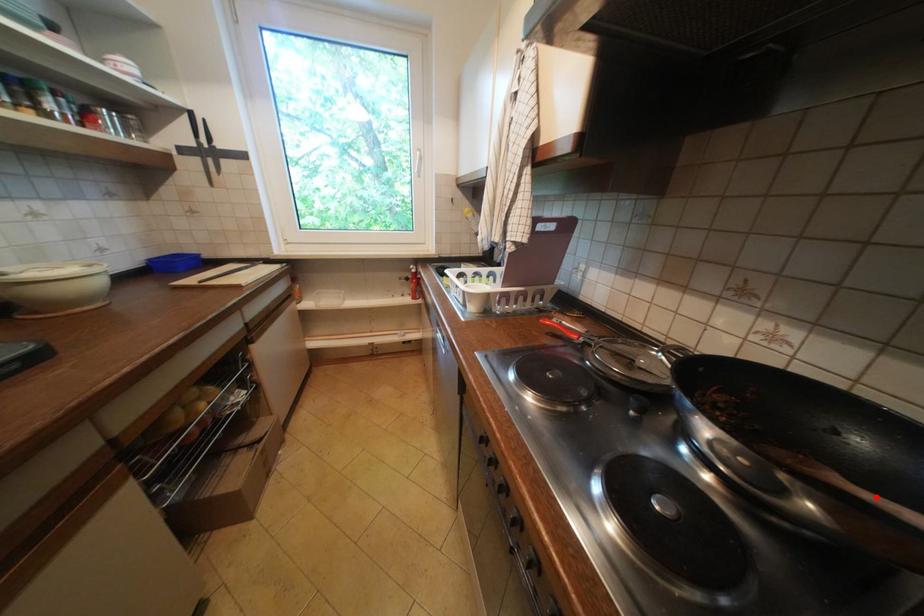
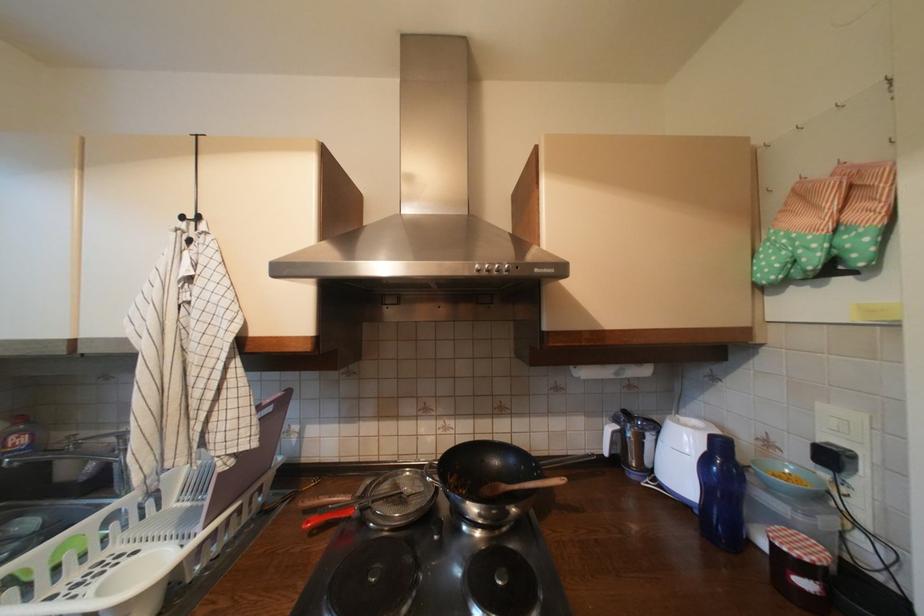
Locate, in the second image, the point that corresponds to the highlighted location in the first image.

(525, 488)